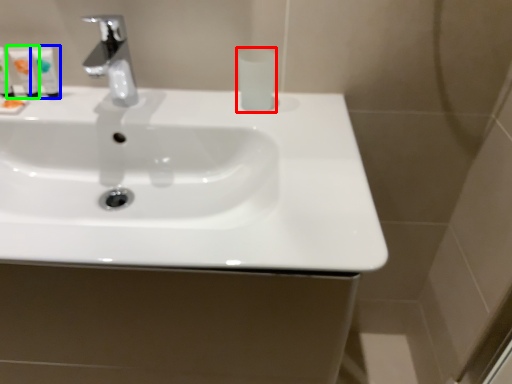
Question: Which object is positioned farthest from mouthwash (highlighted by a red box)? Select from mouthwash (highlighted by a blue box) and mouthwash (highlighted by a green box).

Choices:
 (A) mouthwash
 (B) mouthwash

Answer: (B)